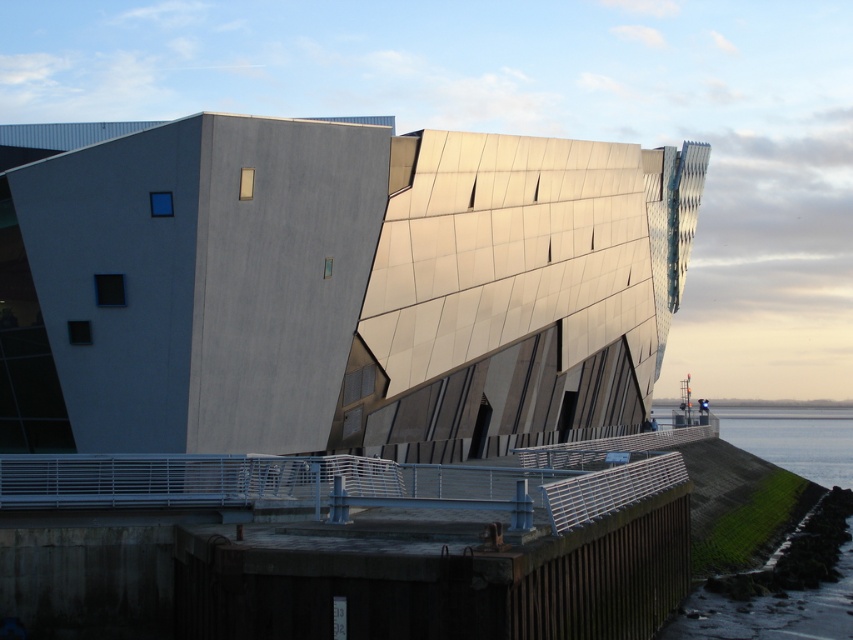
Question: Which of the following is the farthest from the observer?

Choices:
 (A) [465, 332]
 (B) [790, 428]

Answer: (B)

Question: Is metallic glass building at center above concrete dock at lower center?

Choices:
 (A) no
 (B) yes

Answer: (B)

Question: Which object appears farthest from the camera in this image?

Choices:
 (A) clear water at lower right
 (B) metallic glass building at center
 (C) concrete dock at lower center

Answer: (A)

Question: Where is metallic glass building at center located in relation to clear water at lower right in the image?

Choices:
 (A) right
 (B) left

Answer: (B)

Question: Which of these objects is positioned closest to the concrete dock at lower center?

Choices:
 (A) metallic glass building at center
 (B) clear water at lower right

Answer: (A)

Question: Does concrete dock at lower center appear on the left side of clear water at lower right?

Choices:
 (A) no
 (B) yes

Answer: (B)